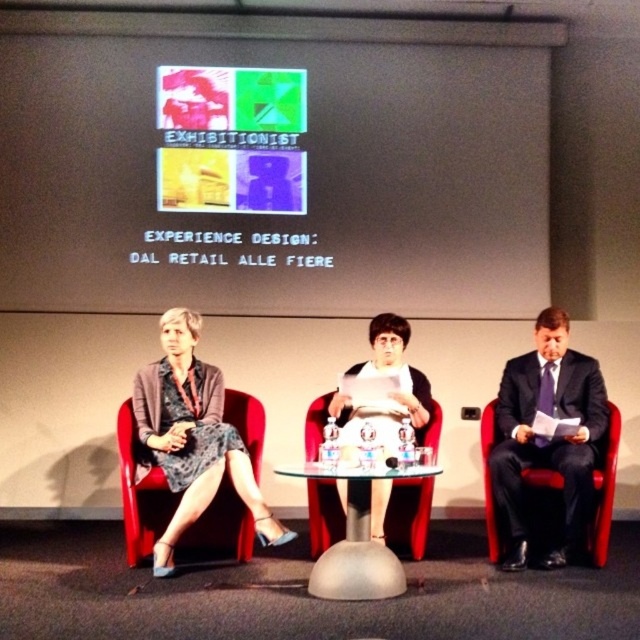
What is the object located at the coordinates point (273, 163) in the image?

The point (273, 163) indicates the white matte projection screen at upper center.

You are a guest speaker preparing to present in the conference room. You need to position your laptop so that it is closer to the transparent glass chair at center than to the white matte projection screen at upper center. Where should you place the laptop?

The white matte projection screen at upper center is further away from the viewer than the transparent glass chair at center. Therefore, placing the laptop near the transparent glass chair at center would ensure it is closer to the chair than the screen.

You are an event organizer setting up for a presentation. You have a white matte projection screen at upper center and a transparent glass chair at center. Which object is wider?

The white matte projection screen at upper center is wider than the transparent glass chair at center.